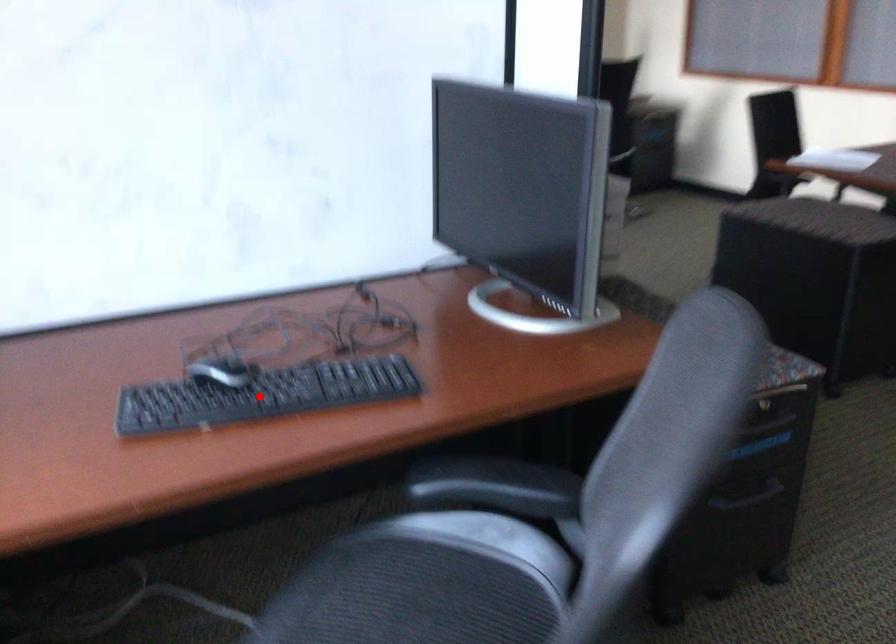
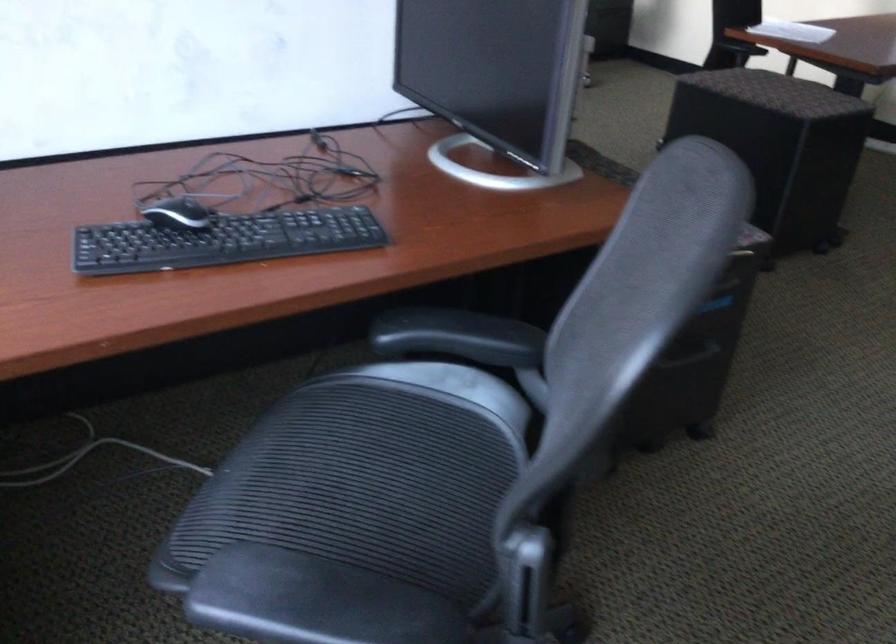
The point at the highlighted location is marked in the first image. Where is the corresponding point in the second image?

(222, 240)